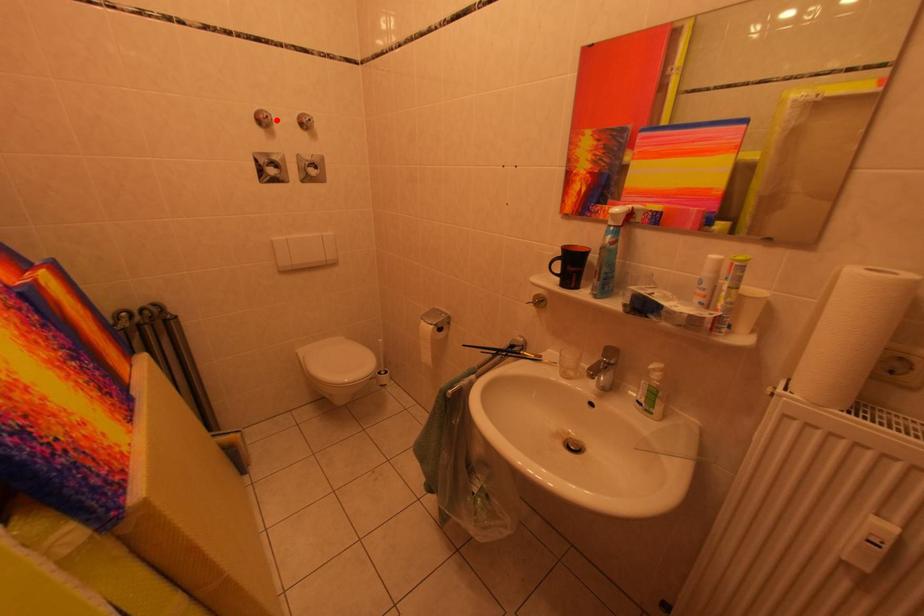
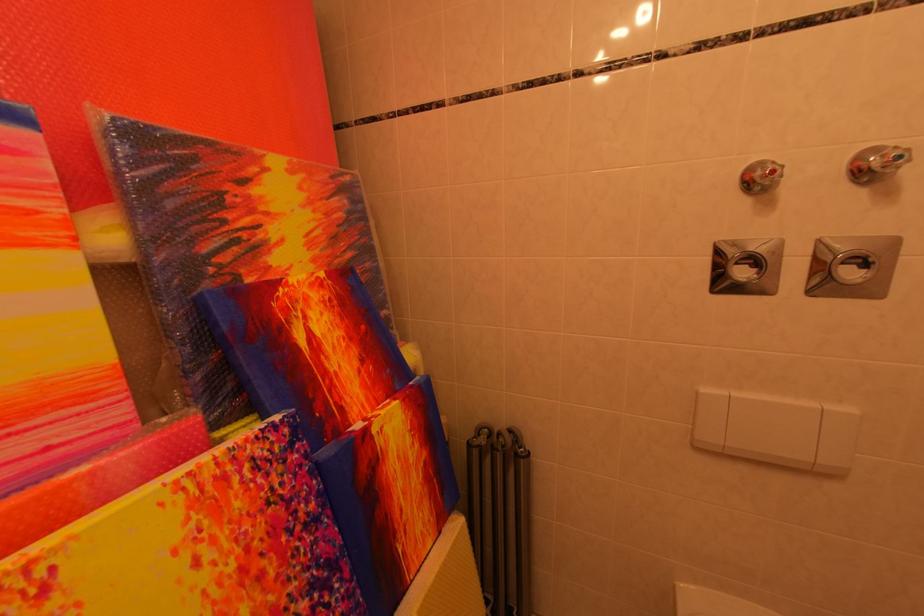
Locate, in the second image, the point that corresponds to the highlighted location in the first image.

(782, 176)